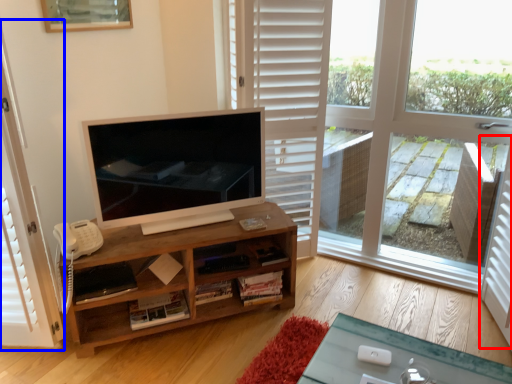
Question: Among these objects, which one is nearest to the camera, screen door (highlighted by a red box) or screen door (highlighted by a blue box)?

Choices:
 (A) screen door
 (B) screen door

Answer: (B)